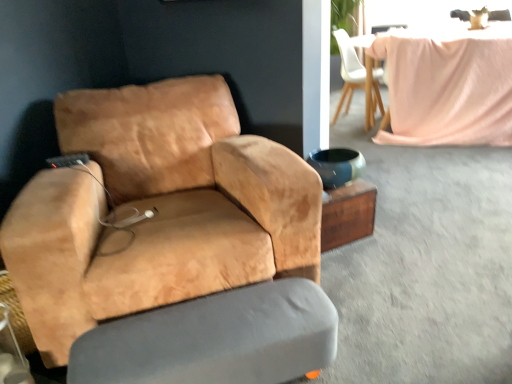
The image size is (512, 384). Describe the element at coordinates (155, 210) in the screenshot. I see `suede tan chair at left, acting as the 1th chair starting from the left` at that location.

This screenshot has height=384, width=512. In order to click on wooden side table at center in this screenshot , I will do `click(348, 214)`.

You are a GUI agent. You are given a task and a screenshot of the screen. Output one action in this format:
    pyautogui.click(x=<x>, y=<y>)
    Task: Click on the white matte chair at upper center, the 1th chair when ordered from top to bottom
    The width and height of the screenshot is (512, 384).
    Given the screenshot: What is the action you would take?
    pyautogui.click(x=358, y=75)

Would you say white matte chair at upper center, the 1th chair when ordered from top to bottom, is outside suede tan chair at left, acting as the 1th chair starting from the left?

Absolutely, white matte chair at upper center, the 1th chair when ordered from top to bottom, is external to suede tan chair at left, acting as the 1th chair starting from the left.

From the image's perspective, does white matte chair at upper center, the 1th chair when ordered from top to bottom, appear lower than suede tan chair at left, acting as the 1th chair starting from the left?

Actually, white matte chair at upper center, the 1th chair when ordered from top to bottom, appears above suede tan chair at left, acting as the 1th chair starting from the left, in the image.

Is gray fabric swivel chair at lower center with suede tan chair at left, the second chair viewed from the right?

No.

Is gray fabric swivel chair at lower center turned away from suede tan chair at left, the second chair viewed from the right?

Yes, gray fabric swivel chair at lower center's orientation is away from suede tan chair at left, the second chair viewed from the right.

From the image's perspective, which object appears higher, gray fabric swivel chair at lower center or suede tan chair at left, the 1th chair when ordered from bottom to top?

suede tan chair at left, the 1th chair when ordered from bottom to top, is shown above in the image.

Consider the image. How many degrees apart are the facing directions of gray fabric swivel chair at lower center and suede tan chair at left, acting as the 1th chair starting from the left?

There is a 0.682-degree angle between the facing directions of gray fabric swivel chair at lower center and suede tan chair at left, acting as the 1th chair starting from the left.

Does white matte chair at upper center, the first chair from the right, turn towards gray fabric swivel chair at lower center?

No, white matte chair at upper center, the first chair from the right, is not aimed at gray fabric swivel chair at lower center.

Considering the sizes of objects white matte chair at upper center, which appears as the 2th chair when ordered from the bottom, and gray fabric swivel chair at lower center in the image provided, who is shorter, white matte chair at upper center, which appears as the 2th chair when ordered from the bottom, or gray fabric swivel chair at lower center?

gray fabric swivel chair at lower center.

From a real-world perspective, relative to gray fabric swivel chair at lower center, is white matte chair at upper center, the first chair from the right, vertically above or below?

In terms of real-world spatial position, white matte chair at upper center, the first chair from the right, is above gray fabric swivel chair at lower center.

Is white matte chair at upper center, the 1th chair when ordered from back to front, turned away from wooden side table at center?

No, white matte chair at upper center, the 1th chair when ordered from back to front, is not facing the opposite direction of wooden side table at center.

Can we say white matte chair at upper center, the 1th chair when ordered from back to front, lies outside wooden side table at center?

Yes, white matte chair at upper center, the 1th chair when ordered from back to front, is located beyond the bounds of wooden side table at center.

Which is in front, point (354, 39) or point (367, 194)?

Point (367, 194)

From the image's perspective, is wooden side table at center above white matte chair at upper center, the 1th chair when ordered from back to front?

No, from the image's perspective, wooden side table at center is not over white matte chair at upper center, the 1th chair when ordered from back to front.

Is wooden side table at center bigger or smaller than white matte chair at upper center, which ranks as the second chair in front-to-back order?

wooden side table at center is smaller than white matte chair at upper center, which ranks as the second chair in front-to-back order.

Locate an element on the screen. The height and width of the screenshot is (384, 512). the 1st chair above the wooden side table at center (from a real-world perspective) is located at coordinates (358, 75).

Could you tell me if wooden side table at center is facing white matte chair at upper center, which ranks as the 2th chair in left-to-right order?

No.

This screenshot has width=512, height=384. I want to click on side table on the right of suede tan chair at left, the 2th chair when ordered from top to bottom, so click(x=348, y=214).

Considering the sizes of wooden side table at center and suede tan chair at left, the second chair positioned from the back, in the image, is wooden side table at center wider or thinner than suede tan chair at left, the second chair positioned from the back,?

Considering their sizes, wooden side table at center looks slimmer than suede tan chair at left, the second chair positioned from the back.

Is wooden side table at center facing away from suede tan chair at left, placed as the first chair when sorted from front to back?

wooden side table at center is not turned away from suede tan chair at left, placed as the first chair when sorted from front to back.

Is wooden side table at center touching suede tan chair at left, placed as the first chair when sorted from front to back?

No, wooden side table at center is not with suede tan chair at left, placed as the first chair when sorted from front to back.

In the scene shown: In terms of height, does wooden side table at center look taller or shorter compared to gray fabric swivel chair at lower center?

In the image, wooden side table at center appears to be taller than gray fabric swivel chair at lower center.

Find the location of a particular element. swivel chair located on the left of wooden side table at center is located at coordinates (215, 339).

Which is behind, point (353, 225) or point (305, 295)?

The point (353, 225) is more distant.

How many degrees apart are the facing directions of wooden side table at center and gray fabric swivel chair at lower center?

The angular difference between wooden side table at center and gray fabric swivel chair at lower center is 9.78 degrees.

Locate an element on the screen. This screenshot has width=512, height=384. chair beneath the suede tan chair at left, the second chair positioned from the back (from a real-world perspective) is located at coordinates (358, 75).

Locate an element on the screen. chair in front of the gray fabric swivel chair at lower center is located at coordinates (155, 210).

Estimate the real-world distances between objects in this image. Which object is further from white matte chair at upper center, the first chair from the right, gray fabric swivel chair at lower center or suede tan chair at left, the 2th chair when ordered from top to bottom?

gray fabric swivel chair at lower center.

Considering their positions, is white matte chair at upper center, the 1th chair when ordered from back to front, positioned further to suede tan chair at left, the second chair viewed from the right, than gray fabric swivel chair at lower center?

The object further to suede tan chair at left, the second chair viewed from the right, is white matte chair at upper center, the 1th chair when ordered from back to front.

Based on their spatial positions, is wooden side table at center or white matte chair at upper center, the 1th chair when ordered from back to front, further from gray fabric swivel chair at lower center?

white matte chair at upper center, the 1th chair when ordered from back to front.

Which object lies further to the anchor point white matte chair at upper center, which ranks as the 2th chair in left-to-right order, wooden side table at center or gray fabric swivel chair at lower center?

Based on the image, gray fabric swivel chair at lower center appears to be further to white matte chair at upper center, which ranks as the 2th chair in left-to-right order.

Which object lies nearer to the anchor point gray fabric swivel chair at lower center, wooden side table at center or suede tan chair at left, the second chair positioned from the back?

Among the two, suede tan chair at left, the second chair positioned from the back, is located nearer to gray fabric swivel chair at lower center.

Based on their spatial positions, is wooden side table at center or gray fabric swivel chair at lower center further from suede tan chair at left, the second chair viewed from the right?

wooden side table at center is further to suede tan chair at left, the second chair viewed from the right.

From the image, which object appears to be farther from wooden side table at center, white matte chair at upper center, which ranks as the 2th chair in left-to-right order, or suede tan chair at left, placed as the first chair when sorted from front to back?

Based on the image, white matte chair at upper center, which ranks as the 2th chair in left-to-right order, appears to be further to wooden side table at center.

Estimate the real-world distances between objects in this image. Which object is closer to gray fabric swivel chair at lower center, white matte chair at upper center, the 1th chair when ordered from back to front, or wooden side table at center?

wooden side table at center lies closer to gray fabric swivel chair at lower center than the other object.

Locate an element on the screen. The height and width of the screenshot is (384, 512). swivel chair between suede tan chair at left, the second chair viewed from the right, and wooden side table at center in the front-back direction is located at coordinates (215, 339).

Where is `side table positioned between gray fabric swivel chair at lower center and white matte chair at upper center, the 1th chair when ordered from back to front, from near to far`? The width and height of the screenshot is (512, 384). side table positioned between gray fabric swivel chair at lower center and white matte chair at upper center, the 1th chair when ordered from back to front, from near to far is located at coordinates (348, 214).

Where is `side table located between suede tan chair at left, the 1th chair when ordered from bottom to top, and white matte chair at upper center, which ranks as the 2th chair in left-to-right order, in the depth direction`? This screenshot has height=384, width=512. side table located between suede tan chair at left, the 1th chair when ordered from bottom to top, and white matte chair at upper center, which ranks as the 2th chair in left-to-right order, in the depth direction is located at coordinates (348, 214).

The width and height of the screenshot is (512, 384). I want to click on swivel chair between suede tan chair at left, acting as the 1th chair starting from the left, and white matte chair at upper center, the first chair from the right, from front to back, so click(215, 339).